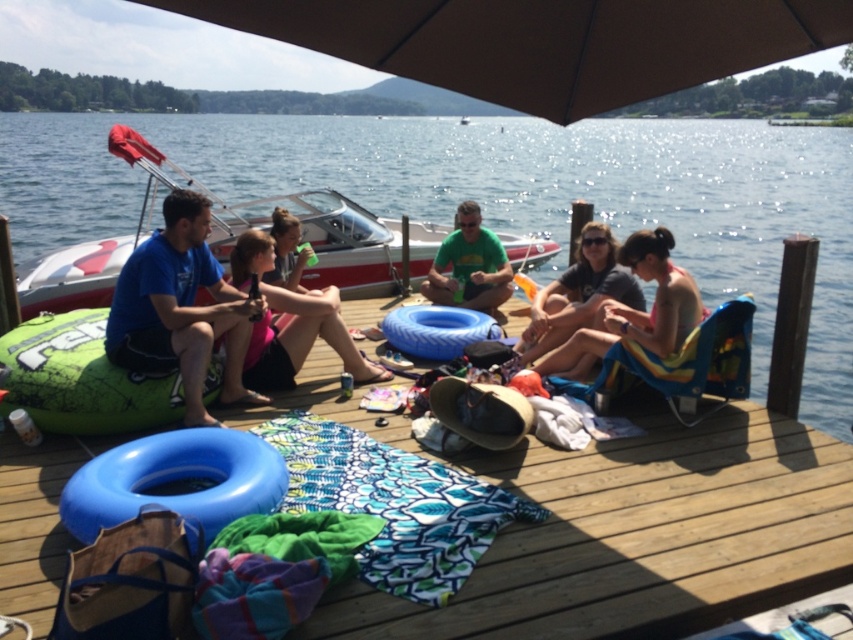
You are standing on the wooden deck at center and want to hand a snack to someone wearing the green matte shirt at center. Which direction should you move to reach them?

Since the wooden deck at center is closer to the viewer than the green matte shirt at center, you should move backward away from the deck toward the shirt.

You are a photographer standing on the dock and want to capture both the blue rubber ring at center and the pink fabric at center in the same frame. Which object should you position to your left to ensure both are in the shot?

You should position the pink fabric at center to your left since the blue rubber ring at center is to the right of the pink fabric at center.